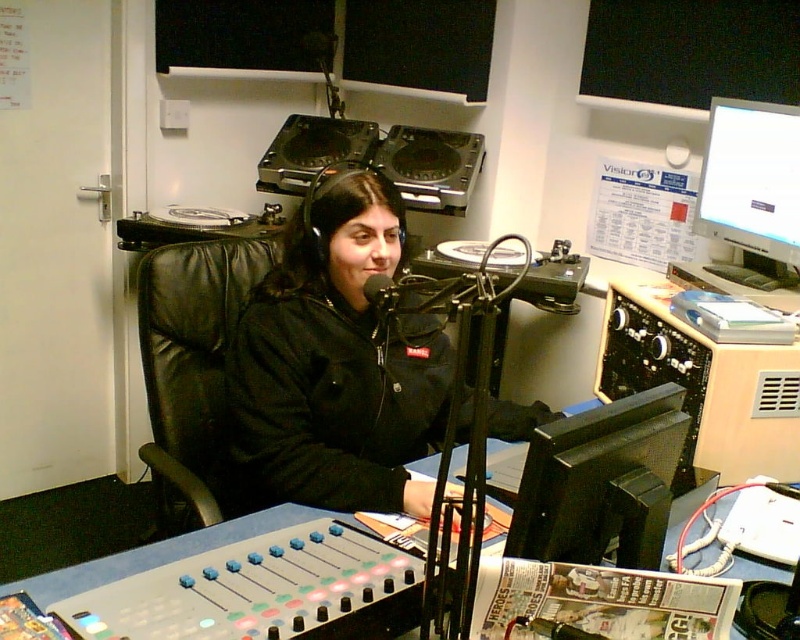
Does black leather chair at center have a greater height compared to blue plastic table at center?

Correct, black leather chair at center is much taller as blue plastic table at center.

Identify the location of black leather chair at center. This screenshot has height=640, width=800. (192, 369).

Between point (158, 461) and point (517, 468), which one is positioned behind?

The point (158, 461) is behind.

The width and height of the screenshot is (800, 640). I want to click on black leather chair at center, so click(x=192, y=369).

Who is positioned more to the right, black matte jacket at center or black leather chair at center?

Positioned to the right is black matte jacket at center.

Is black matte jacket at center wider than black leather chair at center?

Correct, the width of black matte jacket at center exceeds that of black leather chair at center.

You are a GUI agent. You are given a task and a screenshot of the screen. Output one action in this format:
    pyautogui.click(x=<x>, y=<y>)
    Task: Click on the black matte jacket at center
    This screenshot has height=640, width=800.
    Given the screenshot: What is the action you would take?
    pyautogui.click(x=336, y=365)

Can you confirm if black matte jacket at center is positioned above blue plastic table at center?

Correct, black matte jacket at center is located above blue plastic table at center.

The image size is (800, 640). What do you see at coordinates (336, 365) in the screenshot? I see `black matte jacket at center` at bounding box center [336, 365].

Is point (428, 486) in front of point (169, 557)?

That is False.

Identify the location of black matte jacket at center. This screenshot has width=800, height=640. (336, 365).